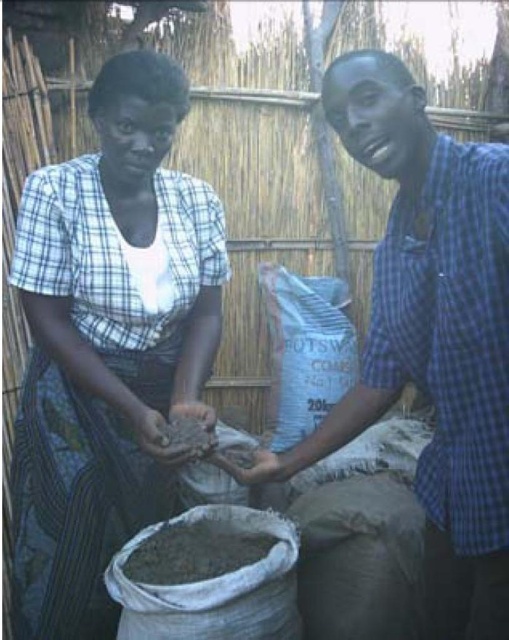
Question: Which object is closer to the camera taking this photo?

Choices:
 (A) white cotton dress at center
 (B) gray matte sand at center

Answer: (A)

Question: Is white cotton dress at center above brown clay at center?

Choices:
 (A) no
 (B) yes

Answer: (B)

Question: Can you confirm if white cotton dress at center is positioned above blue checkered shirt at center?

Choices:
 (A) no
 (B) yes

Answer: (B)

Question: Which point is closer to the camera?

Choices:
 (A) gray matte sand at center
 (B) blue checkered shirt at center

Answer: (B)

Question: Which is nearer to the white cotton dress at center?

Choices:
 (A) brown clay at center
 (B) blue checkered shirt at center
 (C) gray matte sand at center

Answer: (A)

Question: Does blue checkered shirt at center lie in front of brown clay at center?

Choices:
 (A) no
 (B) yes

Answer: (B)